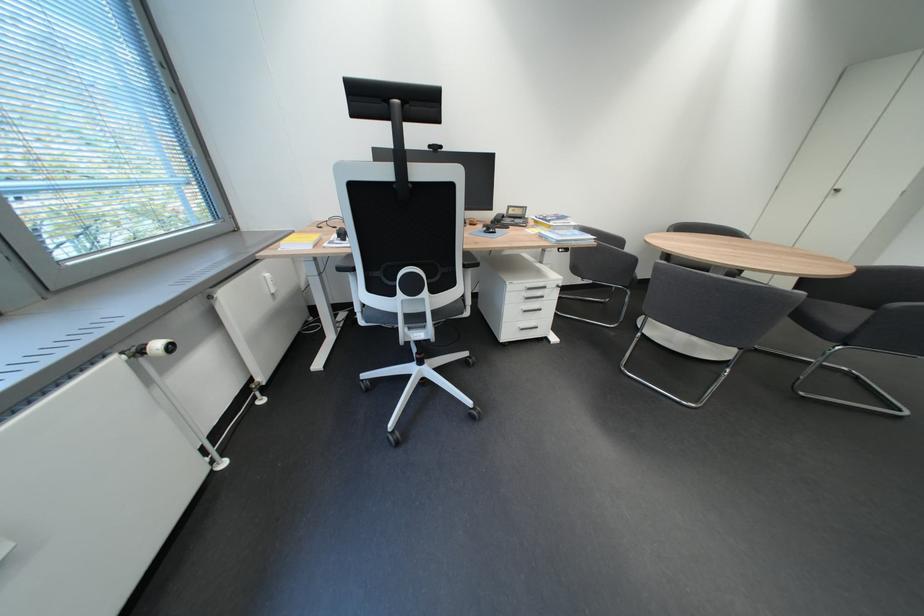
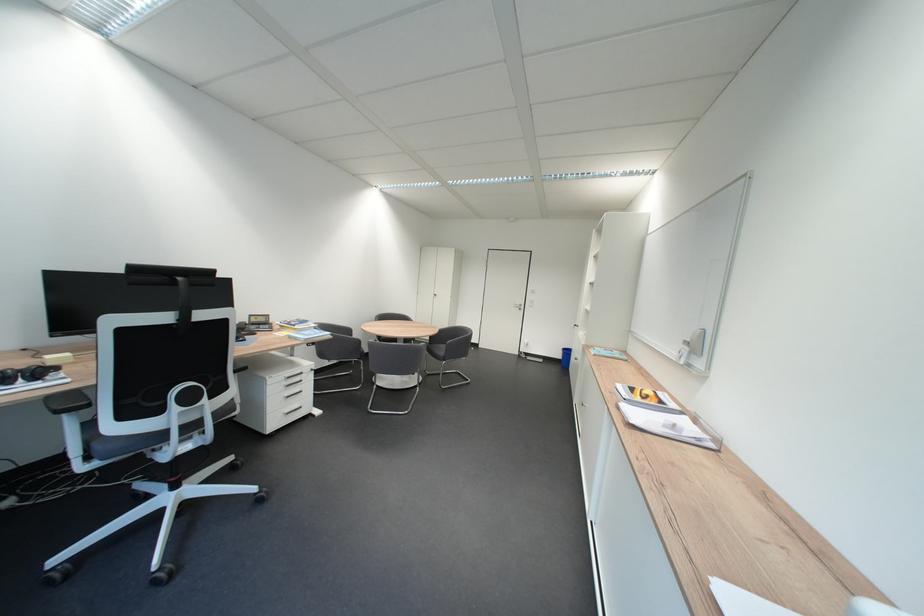
Locate, in the second image, the point that corresponds to the point at 877,314 in the first image.

(456, 347)